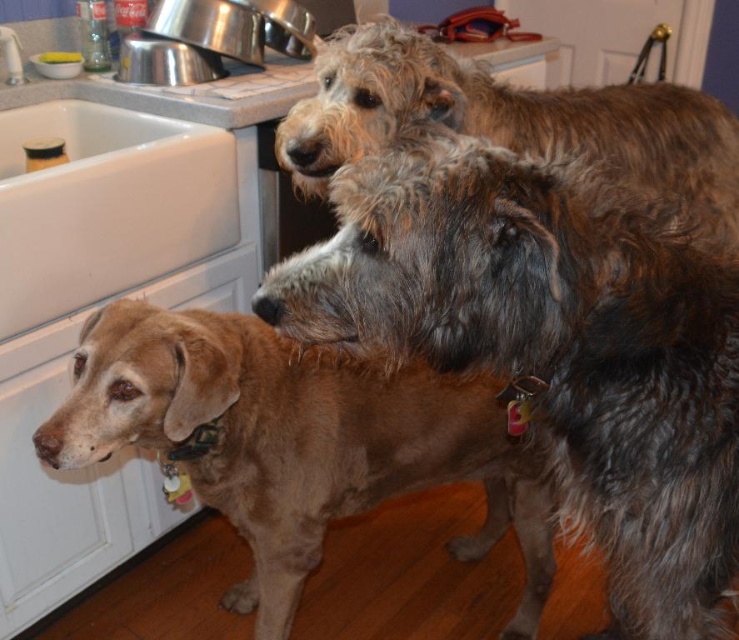
Which is more to the right, brown fur dog at left or fuzzy brown dog at upper center?

From the viewer's perspective, fuzzy brown dog at upper center appears more on the right side.

Looking at this image, does brown fur dog at left have a greater width compared to fuzzy brown dog at upper center?

No.

At what (x,y) coordinates should I click in order to perform the action: click on brown fur dog at left. Please return your answer as a coordinate pair (x, y). This screenshot has width=739, height=640. Looking at the image, I should click on (293, 442).

Which of these two, white ceramic sink at left or matte plastic bowl at sink left, stands taller?

white ceramic sink at left is taller.

Is point (160, 237) closer to viewer compared to point (44, 54)?

That is True.

Who is more forward, (68, 227) or (40, 61)?

Point (68, 227) is more forward.

Locate an element on the screen. This screenshot has width=739, height=640. white ceramic sink at left is located at coordinates (106, 205).

Who is taller, fuzzy brown dog at center or matte plastic bowl at sink left?

fuzzy brown dog at center

In the scene shown: Which is more to the left, fuzzy brown dog at center or matte plastic bowl at sink left?

Positioned to the left is matte plastic bowl at sink left.

Is point (466, 307) farther from viewer compared to point (61, 51)?

That is False.

The width and height of the screenshot is (739, 640). I want to click on fuzzy brown dog at center, so point(551,348).